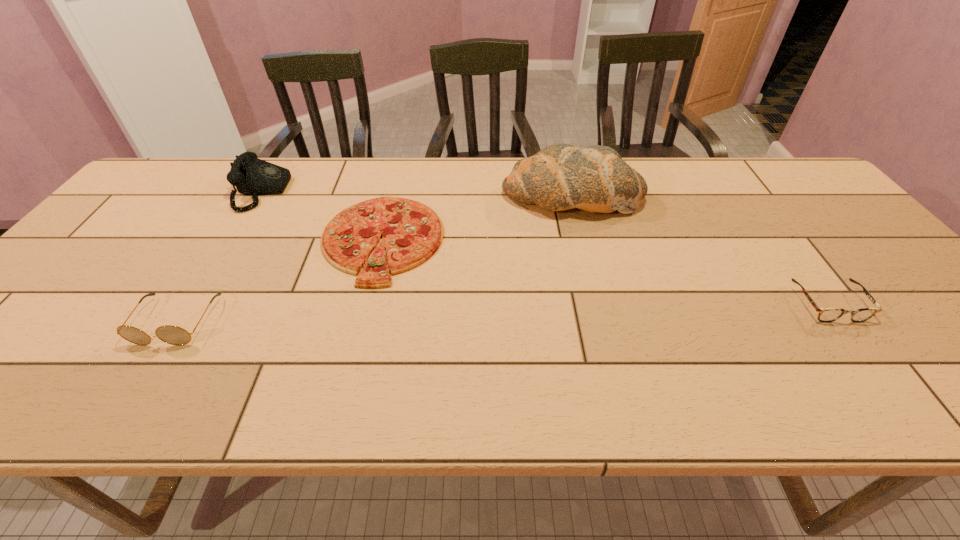
You are a GUI agent. You are given a task and a screenshot of the screen. Output one action in this format:
    pyautogui.click(x=<x>, y=<y>)
    Task: Click on the fourth object from left to right
    This screenshot has width=960, height=540.
    Given the screenshot: What is the action you would take?
    pyautogui.click(x=559, y=177)

I want to click on bread, so click(559, 177).

This screenshot has width=960, height=540. In order to click on the second tallest object in this screenshot , I will do `click(252, 176)`.

Where is `sunglasses`? sunglasses is located at coordinates click(173, 335).

At what (x,y) coordinates should I click in order to perform the action: click on the rightmost object. Please return your answer as a coordinate pair (x, y). This screenshot has width=960, height=540. Looking at the image, I should click on (825, 314).

The image size is (960, 540). In order to click on the fourth tallest object in this screenshot , I will do `click(825, 314)`.

This screenshot has height=540, width=960. Identify the location of the shortest object. (412, 232).

This screenshot has height=540, width=960. I want to click on the third object from left to right, so click(x=412, y=232).

You are a GUI agent. You are given a task and a screenshot of the screen. Output one action in this format:
    pyautogui.click(x=<x>, y=<y>)
    Task: Click on the free space located on the front of the fourth object from left to right
    Image resolution: width=960 pixels, height=540 pixels.
    Given the screenshot: What is the action you would take?
    pyautogui.click(x=600, y=306)

Find the location of a particular element. This screenshot has width=960, height=540. free space located on the dial of the telephone is located at coordinates (389, 192).